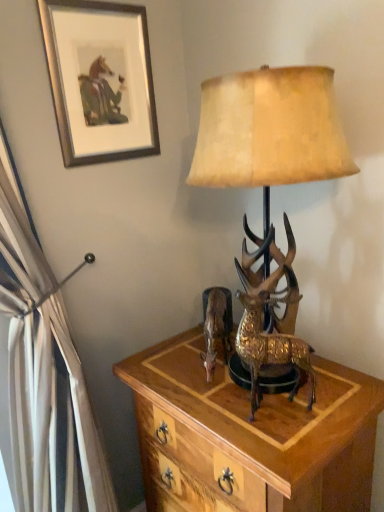
Question: From a real-world perspective, is metallic gold reindeer at center on top of gold textured deer at center?

Choices:
 (A) yes
 (B) no

Answer: (B)

Question: From the image's perspective, does metallic gold reindeer at center appear lower than gold textured deer at center?

Choices:
 (A) yes
 (B) no

Answer: (A)

Question: Can you confirm if metallic gold reindeer at center is bigger than gold textured deer at center?

Choices:
 (A) no
 (B) yes

Answer: (A)

Question: Can you confirm if metallic gold reindeer at center is shorter than gold textured deer at center?

Choices:
 (A) no
 (B) yes

Answer: (B)

Question: Considering the relative positions of metallic gold reindeer at center and gold textured deer at center in the image provided, is metallic gold reindeer at center to the right of gold textured deer at center from the viewer's perspective?

Choices:
 (A) no
 (B) yes

Answer: (A)

Question: From a real-world perspective, relative to wooden nightstand at center, is gold textured deer at center vertically above or below?

Choices:
 (A) above
 (B) below

Answer: (A)

Question: Is gold textured deer at center situated inside wooden nightstand at center or outside?

Choices:
 (A) inside
 (B) outside

Answer: (B)

Question: In the image, is gold textured deer at center positioned in front of or behind wooden nightstand at center?

Choices:
 (A) behind
 (B) front

Answer: (A)

Question: From their relative heights in the image, would you say gold textured deer at center is taller or shorter than wooden nightstand at center?

Choices:
 (A) tall
 (B) short

Answer: (B)

Question: From a real-world perspective, is gold textured deer at center positioned above or below wooden nightstand at center?

Choices:
 (A) below
 (B) above

Answer: (B)

Question: Is point (248, 184) closer or farther from the camera than point (243, 477)?

Choices:
 (A) closer
 (B) farther

Answer: (A)

Question: From the image's perspective, relative to wooden nightstand at center, is gold textured deer at center above or below?

Choices:
 (A) below
 (B) above

Answer: (B)

Question: Based on their sizes in the image, would you say gold textured deer at center is bigger or smaller than wooden nightstand at center?

Choices:
 (A) small
 (B) big

Answer: (A)

Question: From a real-world perspective, is gold textured deer at center physically located above or below silver metallic picture frame at upper left?

Choices:
 (A) above
 (B) below

Answer: (B)

Question: From the image's perspective, is gold textured deer at center above or below silver metallic picture frame at upper left?

Choices:
 (A) below
 (B) above

Answer: (A)